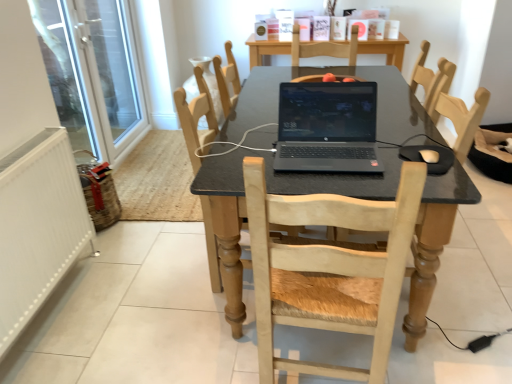
The height and width of the screenshot is (384, 512). I want to click on vacant area that lies between light wood chair at center, which ranks as the second chair in front-to-back order, and white textured radiator at left, so pos(137,307).